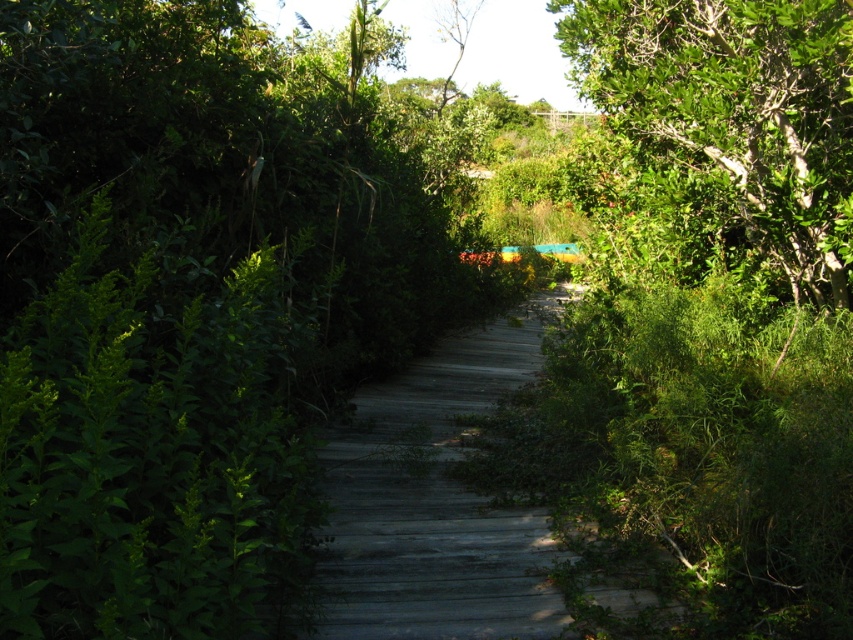
You are standing at the starting point of the boardwalk and want to reach the colorful structure at the far end. If you walk straight ahead along the boardwalk, how far will you have to walk to reach the point marked by the coordinates point (x=756, y=237)?

You will have to walk 6.37 meters to reach the point marked by the coordinates point (x=756, y=237) because the distance between the viewer and the point is 6.37 meters.

You are a hiker trying to navigate through the weathered wood trail at center and the green leafy tree at upper center. Which path has a narrower width?

The weathered wood trail at center has a lesser width compared to the green leafy tree at upper center, so the weathered wood trail at center is narrower.